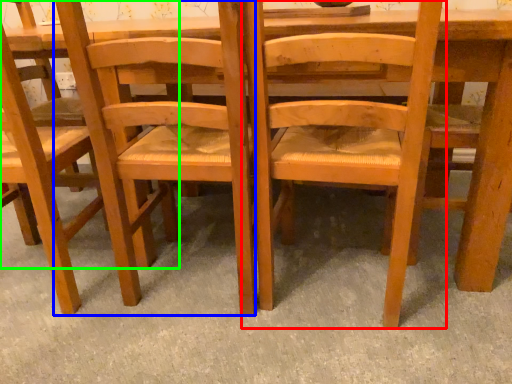
Question: Which is farther away from chair (highlighted by a red box)? chair (highlighted by a blue box) or chair (highlighted by a green box)?

Choices:
 (A) chair
 (B) chair

Answer: (B)